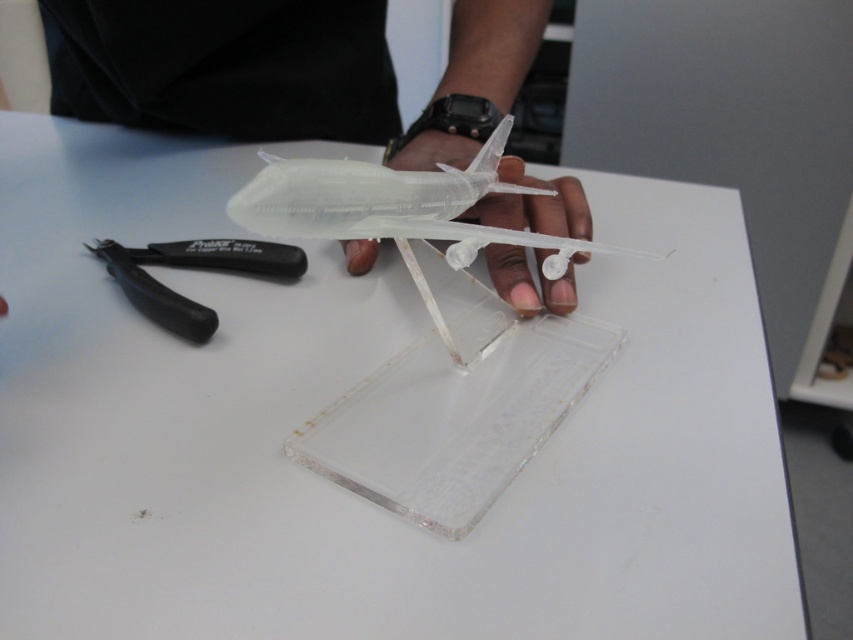
Question: Can you confirm if transparent plastic airplane at center is positioned to the right of black plastic pliers at left?

Choices:
 (A) yes
 (B) no

Answer: (A)

Question: Which object is closer to the camera taking this photo?

Choices:
 (A) transparent plastic airplane at center
 (B) black plastic pliers at left

Answer: (B)

Question: Which point is closer to the camera?

Choices:
 (A) black plastic pliers at left
 (B) transparent plastic airplane at center

Answer: (A)

Question: Does transparent plastic airplane at center have a smaller size compared to black plastic pliers at left?

Choices:
 (A) no
 (B) yes

Answer: (A)

Question: Is transparent plastic airplane at center bigger than black plastic pliers at left?

Choices:
 (A) yes
 (B) no

Answer: (A)